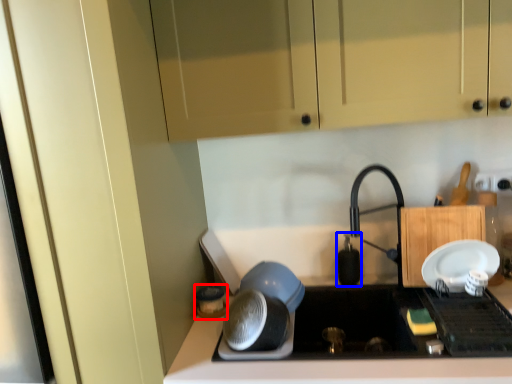
Question: Which of the following is the closest to the observer, appliance (highlighted by a red box) or appliance (highlighted by a blue box)?

Choices:
 (A) appliance
 (B) appliance

Answer: (A)